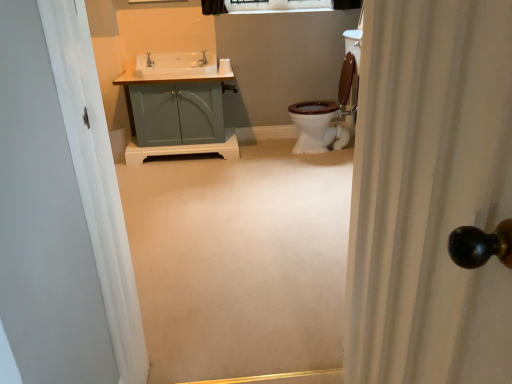
Image resolution: width=512 pixels, height=384 pixels. In order to click on unoccupied region to the right of matte silver faucet at upper center in this screenshot , I will do `click(218, 62)`.